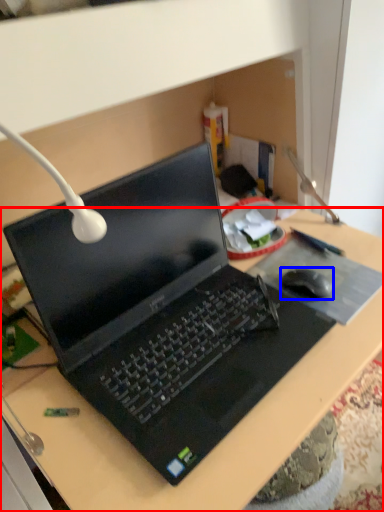
Question: Which object is closer to the camera taking this photo, desk (highlighted by a red box) or mouse (highlighted by a blue box)?

Choices:
 (A) desk
 (B) mouse

Answer: (A)